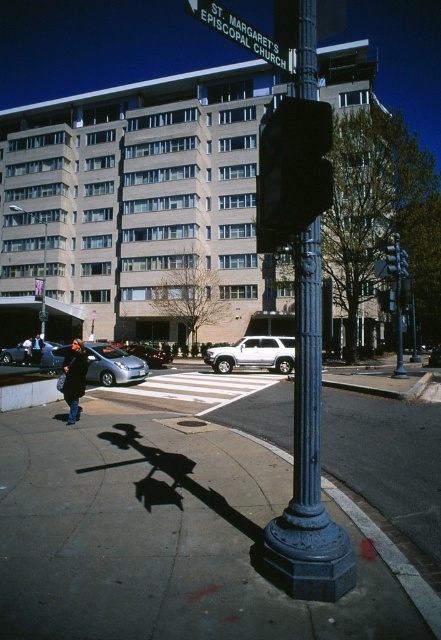
Does black leather coat at lower left appear on the left side of silver metallic sedan at lower left?

Incorrect, black leather coat at lower left is not on the left side of silver metallic sedan at lower left.

Does black leather coat at lower left appear under silver metallic sedan at lower left?

No.

Is point (68, 349) positioned in front of point (12, 356)?

Yes, point (68, 349) is in front of point (12, 356).

Where is `black leather coat at lower left`? The image size is (441, 640). black leather coat at lower left is located at coordinates (74, 378).

Is smooth concrete sidewalk at center wider than silver metallic sedan at center?

Incorrect, smooth concrete sidewalk at center's width does not surpass silver metallic sedan at center's.

Is smooth concrete sidewalk at center to the right of silver metallic sedan at center from the viewer's perspective?

Yes, smooth concrete sidewalk at center is to the right of silver metallic sedan at center.

Which is behind, point (52, 540) or point (144, 344)?

The point (144, 344) is behind.

Image resolution: width=441 pixels, height=640 pixels. I want to click on smooth concrete sidewalk at center, so pos(160,536).

Which is behind, point (310, 428) or point (311, 113)?

Point (310, 428)

Between point (317, 477) and point (306, 109), which one is positioned in front?

Positioned in front is point (306, 109).

At what (x,y) coordinates should I click in order to perform the action: click on blue cast iron pole at center. Please return your answer as a coordinate pair (x, y). The image size is (441, 640). Looking at the image, I should click on (307, 458).